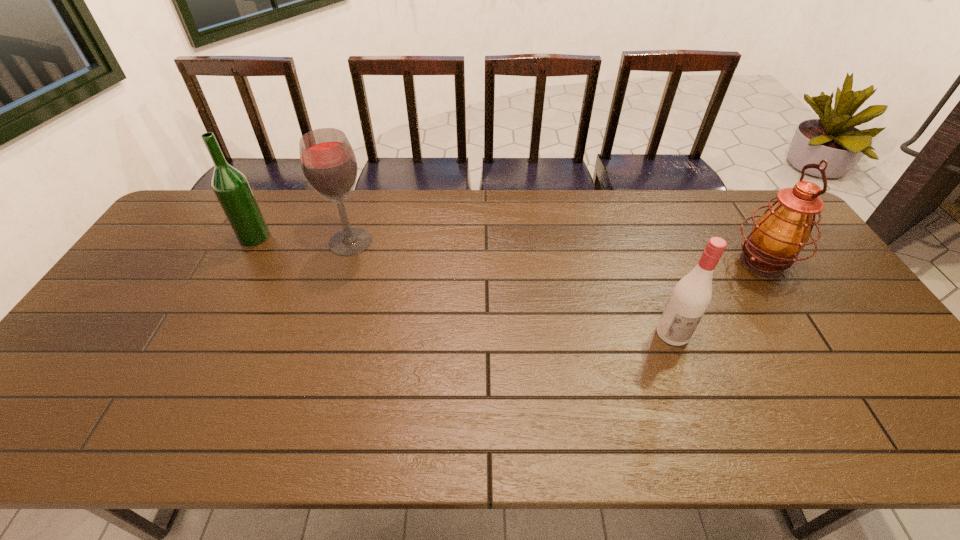
This screenshot has height=540, width=960. In the image, there is a desktop. What are the coordinates of `free space at the far edge` in the screenshot? It's located at (366, 220).

At what (x,y) coordinates should I click in order to perform the action: click on blank space at the near edge of the desktop. Please return your answer as a coordinate pair (x, y). This screenshot has height=540, width=960. Looking at the image, I should click on (260, 434).

The height and width of the screenshot is (540, 960). In order to click on vacant region at the left edge of the desktop in this screenshot , I will do `click(191, 247)`.

In the image, there is a desktop. Where is `vacant region at the right edge`? vacant region at the right edge is located at coordinates (793, 275).

Locate an element on the screen. The width and height of the screenshot is (960, 540). vacant space at the far left corner is located at coordinates (194, 218).

The width and height of the screenshot is (960, 540). In the image, there is a desktop. Identify the location of vacant space at the far right corner. tap(747, 192).

This screenshot has height=540, width=960. Identify the location of unoccupied position between the second alcohol from right to left and the oil lamp. (556, 252).

Find the location of a particular element. This screenshot has height=540, width=960. vacant area that lies between the leftmost alcohol and the second object from right to left is located at coordinates (464, 285).

Locate an element on the screen. empty space between the second alcohol from right to left and the nearest object is located at coordinates (512, 287).

Locate an element on the screen. This screenshot has height=540, width=960. empty location between the rightmost object and the rightmost alcohol is located at coordinates (717, 298).